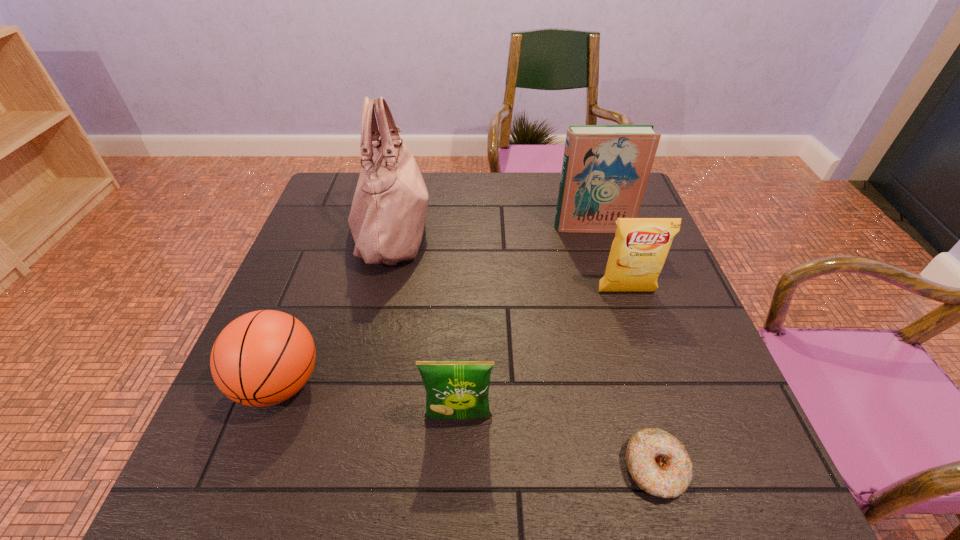
Image resolution: width=960 pixels, height=540 pixels. Find the location of `vacant space located 0.140m on the cover of the second tallest object`. vacant space located 0.140m on the cover of the second tallest object is located at coordinates (605, 267).

Image resolution: width=960 pixels, height=540 pixels. Identify the location of free location located 0.230m on the front of the third tallest object with the logo. (656, 381).

This screenshot has width=960, height=540. What are the coordinates of `free space located 0.060m on the front-facing side of the fourth object from right to left` in the screenshot? It's located at (457, 461).

Identify the location of blank area located on the back of the basketball. The width and height of the screenshot is (960, 540). (314, 292).

The image size is (960, 540). I want to click on free location located on the left of the shortest object, so click(465, 468).

The height and width of the screenshot is (540, 960). I want to click on object located in the far edge section of the desktop, so click(388, 213).

The width and height of the screenshot is (960, 540). In order to click on object that is at the near edge in this screenshot , I will do (x=658, y=462).

The height and width of the screenshot is (540, 960). I want to click on handbag at the left edge, so click(x=388, y=213).

At what (x,y) coordinates should I click in order to perform the action: click on basketball present at the left edge. Please return your answer as a coordinate pair (x, y). Looking at the image, I should click on (262, 358).

You are a GUI agent. You are given a task and a screenshot of the screen. Output one action in this format:
    pyautogui.click(x=<x>, y=<y>)
    Task: Click on the hardback book located in the right edge section of the desktop
    Image resolution: width=960 pixels, height=540 pixels.
    Given the screenshot: What is the action you would take?
    pyautogui.click(x=605, y=170)